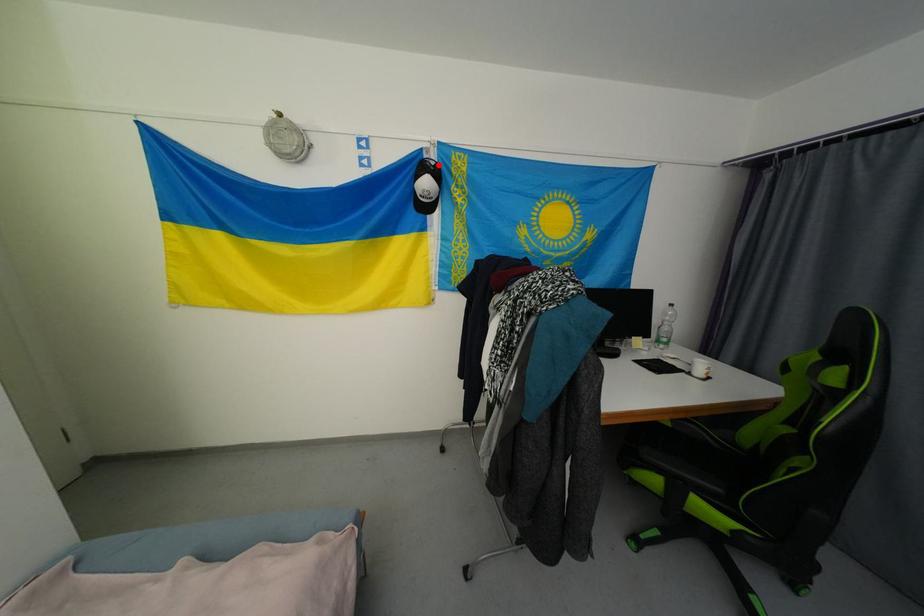
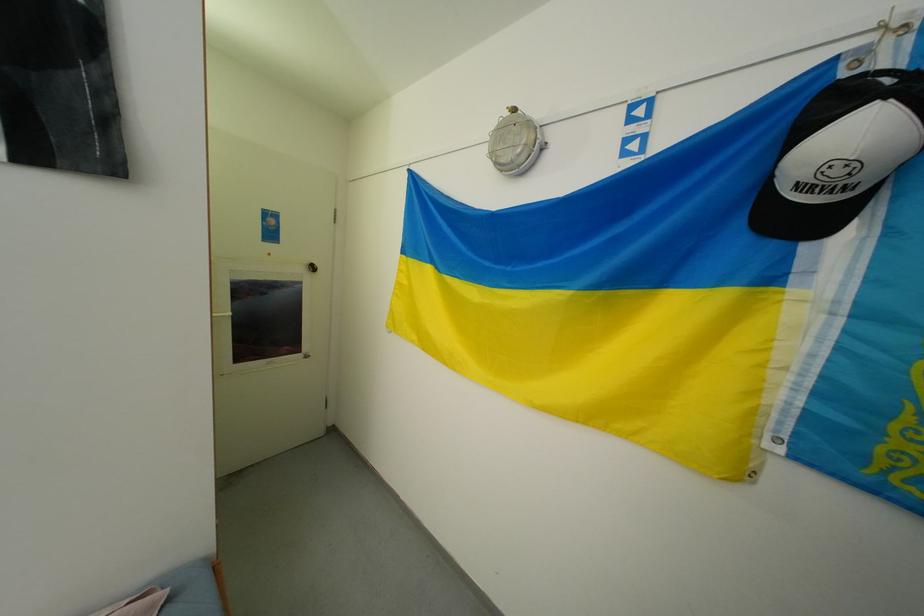
Question: I am providing you with two images of the same scene from different viewpoints. Image1 has a red point marked. In image2, the corresponding 3D location appears at what relative position? Reply with the corresponding letter.

Choices:
 (A) Closer
 (B) Farther

Answer: (B)